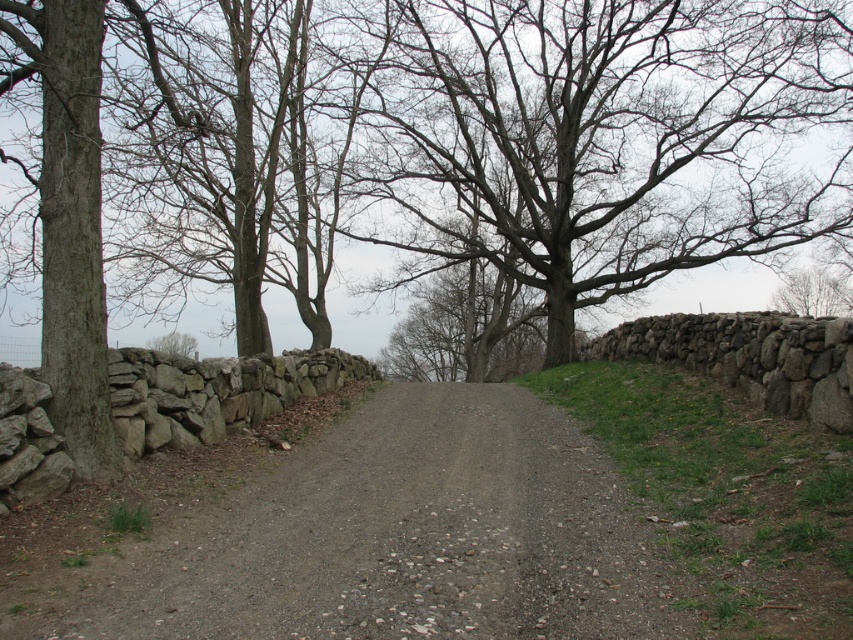
Can you confirm if bare branches at center is taller than gray gravel road at center?

Correct, bare branches at center is much taller as gray gravel road at center.

Between point (773, 170) and point (172, 584), which one is positioned in front?

Positioned in front is point (172, 584).

Find the location of `bare branches at center`. bare branches at center is located at coordinates (602, 138).